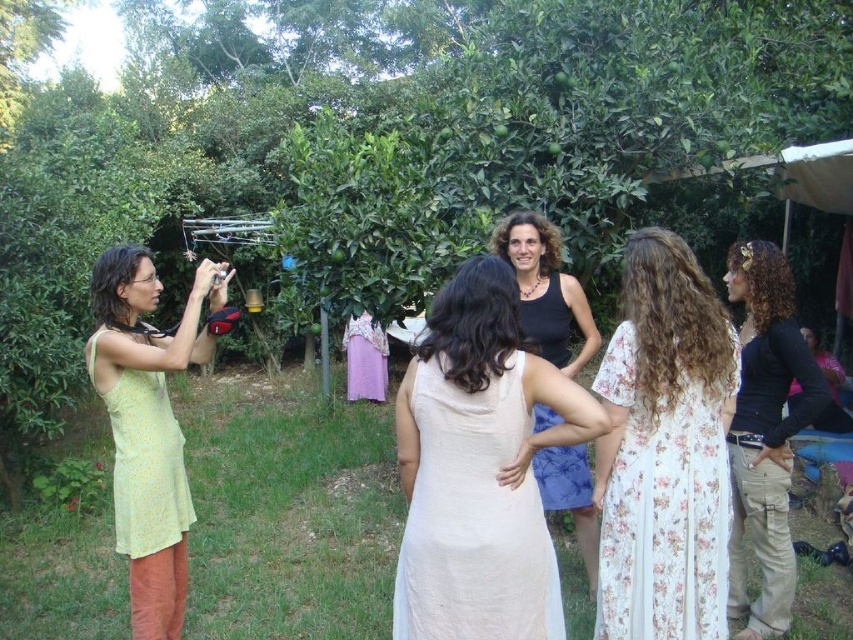
Question: Is light yellow lace dress at left wider than black matte pants at right?

Choices:
 (A) yes
 (B) no

Answer: (A)

Question: From the image, what is the correct spatial relationship of black matte pants at right in relation to yellow floral fabric dress at left?

Choices:
 (A) right
 (B) left

Answer: (A)

Question: Which is nearer to the floral white dress at center?

Choices:
 (A) yellow floral fabric dress at left
 (B) black matte tank top at center
 (C) light beige fabric dress at center
 (D) light yellow lace dress at left

Answer: (C)

Question: Which point is farther to the camera?

Choices:
 (A) floral white dress at center
 (B) black matte pants at right

Answer: (B)

Question: Is floral white dress at center smaller than black matte tank top at center?

Choices:
 (A) yes
 (B) no

Answer: (A)

Question: Which point appears closest to the camera in this image?

Choices:
 (A) (804, 406)
 (B) (122, 384)

Answer: (B)